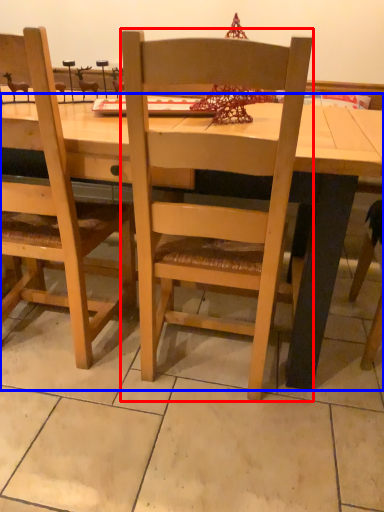
Question: Which point is closer to the camera, chair (highlighted by a red box) or desk (highlighted by a blue box)?

Choices:
 (A) chair
 (B) desk

Answer: (A)